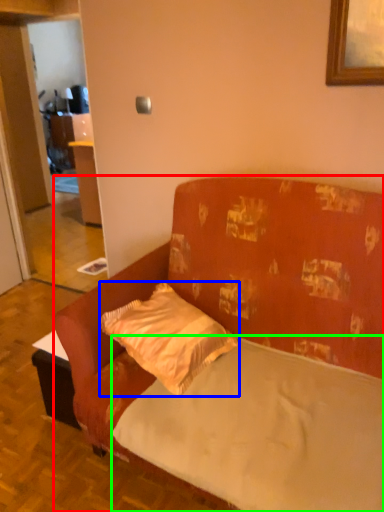
Question: Based on their relative distances, which object is nearer to studio couch (highlighted by a red box)? Choose from pillow (highlighted by a blue box) and mattress (highlighted by a green box).

Choices:
 (A) pillow
 (B) mattress

Answer: (B)